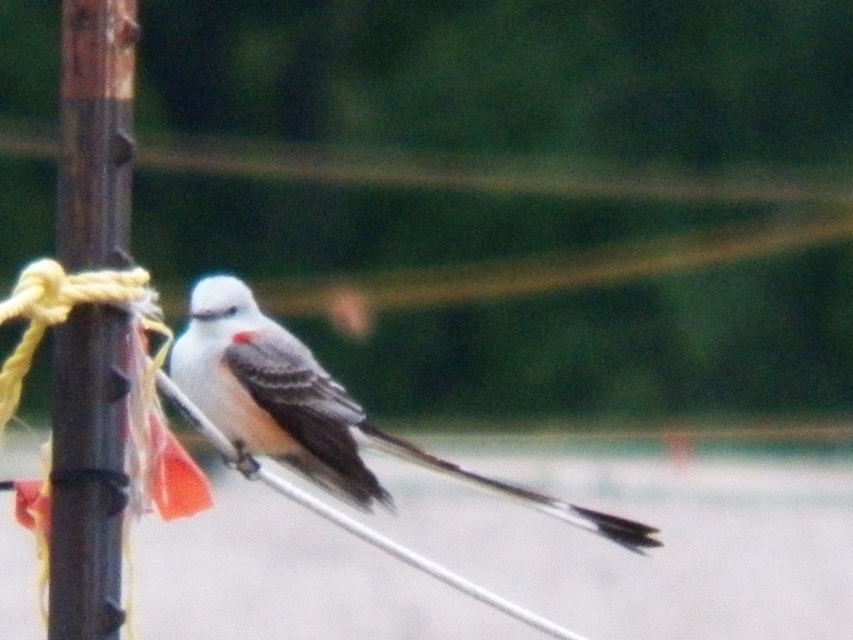
Which of these two, brown wood pole at left or white matte bird at center, stands taller?

brown wood pole at left

Between brown wood pole at left and white matte bird at center, which one has less height?

white matte bird at center is shorter.

Is point (125, 56) positioned in front of point (235, 330)?

Yes, it is in front of point (235, 330).

You are a GUI agent. You are given a task and a screenshot of the screen. Output one action in this format:
    pyautogui.click(x=<x>, y=<y>)
    Task: Click on the brown wood pole at left
    
    Given the screenshot: What is the action you would take?
    pyautogui.click(x=86, y=474)